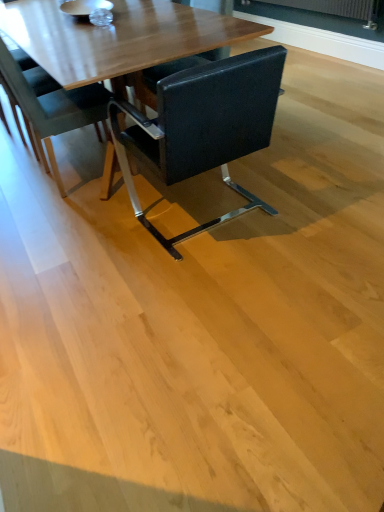
Identify the location of black leather chair at center, arranged as the 1th chair when viewed from the right. Image resolution: width=384 pixels, height=512 pixels. (203, 127).

What do you see at coordinates (203, 127) in the screenshot? I see `black leather chair at center, arranged as the 1th chair when viewed from the right` at bounding box center [203, 127].

The height and width of the screenshot is (512, 384). Describe the element at coordinates (54, 108) in the screenshot. I see `black leather chair at center, the 1th chair viewed from the left` at that location.

Where is `black leather chair at center, the 1th chair viewed from the left`? black leather chair at center, the 1th chair viewed from the left is located at coordinates (54, 108).

At what (x,y) coordinates should I click in order to perform the action: click on black leather chair at center, arranged as the 1th chair when viewed from the right. Please return your answer as a coordinate pair (x, y). The width and height of the screenshot is (384, 512). Looking at the image, I should click on (203, 127).

Which object is positioned more to the right, black leather chair at center, arranged as the 2th chair when viewed from the right, or black leather chair at center, the second chair in the left-to-right sequence?

From the viewer's perspective, black leather chair at center, the second chair in the left-to-right sequence, appears more on the right side.

Which object is more forward, black leather chair at center, arranged as the 2th chair when viewed from the right, or black leather chair at center, the second chair in the left-to-right sequence?

black leather chair at center, the second chair in the left-to-right sequence, is more forward.

Does point (60, 97) lie behind point (271, 114)?

Yes, it is behind point (271, 114).

From the image's perspective, which one is positioned higher, black leather chair at center, arranged as the 2th chair when viewed from the right, or black leather chair at center, the second chair in the left-to-right sequence?

black leather chair at center, arranged as the 2th chair when viewed from the right, is shown above in the image.

From a real-world perspective, is black leather chair at center, arranged as the 2th chair when viewed from the right, located beneath black leather chair at center, the second chair in the left-to-right sequence?

No.

From the picture: Looking at their sizes, would you say black leather chair at center, the 1th chair viewed from the left, is wider or thinner than black leather chair at center, arranged as the 1th chair when viewed from the right?

In the image, black leather chair at center, the 1th chair viewed from the left, appears to be more narrow than black leather chair at center, arranged as the 1th chair when viewed from the right.

Considering the sizes of black leather chair at center, arranged as the 2th chair when viewed from the right, and black leather chair at center, the second chair in the left-to-right sequence, in the image, is black leather chair at center, arranged as the 2th chair when viewed from the right, taller or shorter than black leather chair at center, the second chair in the left-to-right sequence,?

Clearly, black leather chair at center, arranged as the 2th chair when viewed from the right, is taller compared to black leather chair at center, the second chair in the left-to-right sequence.

Considering the sizes of objects black leather chair at center, arranged as the 2th chair when viewed from the right, and black leather chair at center, arranged as the 1th chair when viewed from the right, in the image provided, who is bigger, black leather chair at center, arranged as the 2th chair when viewed from the right, or black leather chair at center, arranged as the 1th chair when viewed from the right,?

black leather chair at center, arranged as the 1th chair when viewed from the right, is bigger.

Is black leather chair at center, the second chair in the left-to-right sequence, completely or partially inside black leather chair at center, arranged as the 2th chair when viewed from the right?

That's incorrect, black leather chair at center, the second chair in the left-to-right sequence, is not inside black leather chair at center, arranged as the 2th chair when viewed from the right.

Can you see black leather chair at center, the 1th chair viewed from the left, touching black leather chair at center, arranged as the 1th chair when viewed from the right?

black leather chair at center, the 1th chair viewed from the left, and black leather chair at center, arranged as the 1th chair when viewed from the right, are not in contact.

Is black leather chair at center, the 1th chair viewed from the left, aimed at black leather chair at center, arranged as the 1th chair when viewed from the right?

No.

What's the angular difference between black leather chair at center, arranged as the 2th chair when viewed from the right, and black leather chair at center, arranged as the 1th chair when viewed from the right,'s facing directions?

They differ by 90 degrees in their facing directions.

Find the location of `chair below the black leather chair at center, arranged as the 2th chair when viewed from the right (from the image's perspective)`. chair below the black leather chair at center, arranged as the 2th chair when viewed from the right (from the image's perspective) is located at coordinates (203, 127).

Visually, is black leather chair at center, arranged as the 1th chair when viewed from the right, positioned to the left or to the right of black leather chair at center, arranged as the 2th chair when viewed from the right?

Based on their positions, black leather chair at center, arranged as the 1th chair when viewed from the right, is located to the right of black leather chair at center, arranged as the 2th chair when viewed from the right.

In the scene shown: Is black leather chair at center, the second chair in the left-to-right sequence, in front of or behind black leather chair at center, the 1th chair viewed from the left, in the image?

black leather chair at center, the second chair in the left-to-right sequence, is in front of black leather chair at center, the 1th chair viewed from the left.

Is point (146, 117) less distant than point (51, 112)?

No, (146, 117) is further to viewer.

From the image's perspective, which one is positioned higher, black leather chair at center, the second chair in the left-to-right sequence, or black leather chair at center, the 1th chair viewed from the left?

black leather chair at center, the 1th chair viewed from the left, appears higher in the image.

From a real-world perspective, which object rests below the other?

black leather chair at center, arranged as the 1th chair when viewed from the right, is physically lower.

Looking at this image, does black leather chair at center, the second chair in the left-to-right sequence, have a greater width compared to black leather chair at center, arranged as the 2th chair when viewed from the right?

Indeed, black leather chair at center, the second chair in the left-to-right sequence, has a greater width compared to black leather chair at center, arranged as the 2th chair when viewed from the right.

Consider the image. Considering the relative sizes of black leather chair at center, the second chair in the left-to-right sequence, and black leather chair at center, the 1th chair viewed from the left, in the image provided, is black leather chair at center, the second chair in the left-to-right sequence, shorter than black leather chair at center, the 1th chair viewed from the left,?

Indeed, black leather chair at center, the second chair in the left-to-right sequence, has a lesser height compared to black leather chair at center, the 1th chair viewed from the left.

Between black leather chair at center, the second chair in the left-to-right sequence, and black leather chair at center, the 1th chair viewed from the left, which one has smaller size?

With smaller size is black leather chair at center, the 1th chair viewed from the left.

Could black leather chair at center, the 1th chair viewed from the left, be considered to be inside black leather chair at center, the second chair in the left-to-right sequence?

Definitely not — black leather chair at center, the 1th chair viewed from the left, is not inside black leather chair at center, the second chair in the left-to-right sequence.

Are black leather chair at center, the second chair in the left-to-right sequence, and black leather chair at center, the 1th chair viewed from the left, far apart?

They are positioned close to each other.

Is black leather chair at center, the second chair in the left-to-right sequence, oriented towards black leather chair at center, arranged as the 2th chair when viewed from the right?

Yes, black leather chair at center, the second chair in the left-to-right sequence, faces towards black leather chair at center, arranged as the 2th chair when viewed from the right.

Image resolution: width=384 pixels, height=512 pixels. In the image, there is a black leather chair at center, arranged as the 1th chair when viewed from the right. In order to click on chair above it (from the image's perspective) in this screenshot , I will do `click(54, 108)`.

Find the location of a particular element. chair beneath the black leather chair at center, the 1th chair viewed from the left (from a real-world perspective) is located at coordinates (203, 127).

Where is `chair located behind the black leather chair at center, the second chair in the left-to-right sequence`? The width and height of the screenshot is (384, 512). chair located behind the black leather chair at center, the second chair in the left-to-right sequence is located at coordinates (54, 108).